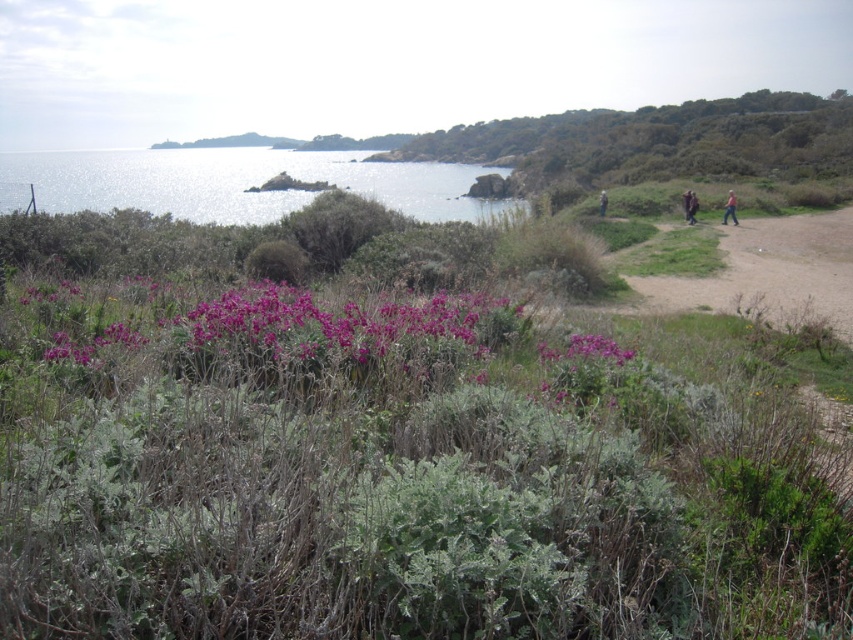
You are standing at the start of the dirt path in the midground. You want to walk towards the pink fabric at right. Which direction should you head to avoid the shiny metallic water at upper left?

To reach the pink fabric at right while avoiding the shiny metallic water at upper left, head towards the right along the dirt path since the pink fabric at right is to the right of the shiny metallic water at upper left.

You are standing at the center of the dirt path in the midground. You want to reach the shiny metallic water at upper left. Which direction should you walk?

You should walk towards the upper left direction to reach the shiny metallic water at upper left.